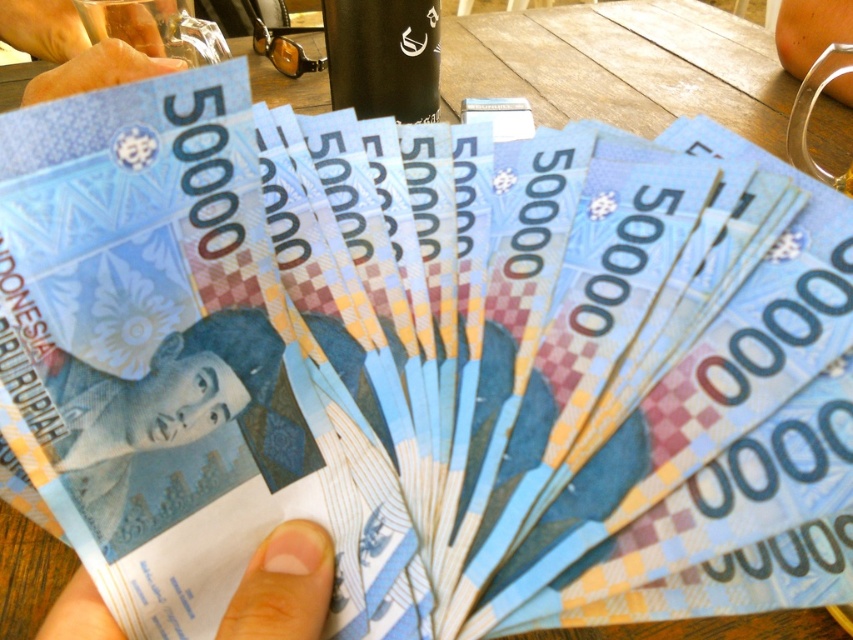
You are organizing a small event and need to place a white matte paper at lower center and a matte plastic hand at upper left on a table. Based on the scene, where should you place the white matte paper relative to the matte plastic hand?

The white matte paper at lower center should be placed on the right side of the matte plastic hand at upper left according to the scene description.

You are designing a card game where you need to stack objects on a table. You have a white matte paper at lower center and a matte plastic hand at upper left. Which object can be placed on top of the other without bending or breaking?

The white matte paper at lower center is thinner than the matte plastic hand at upper left, so the white matte paper at lower center can be placed on top of the matte plastic hand at upper left without bending or breaking.